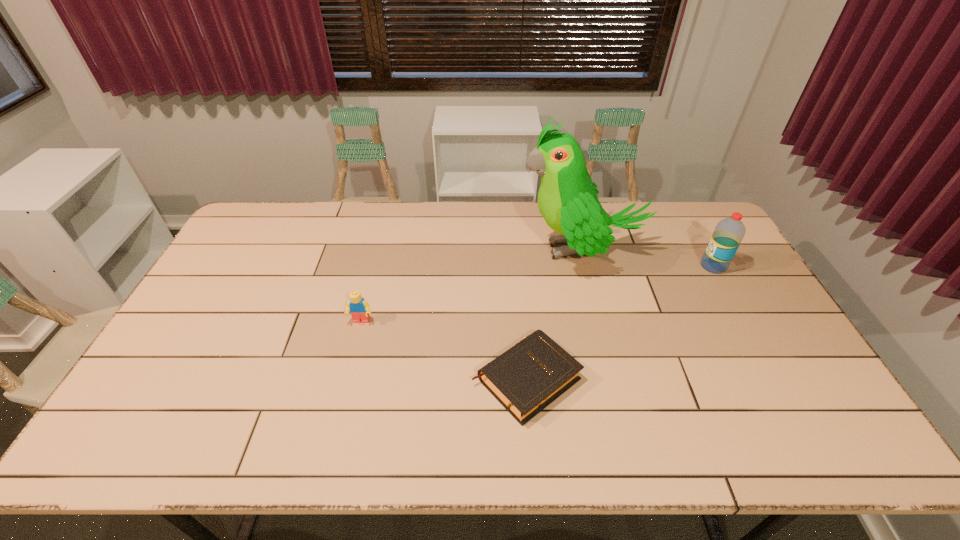
You are a GUI agent. You are given a task and a screenshot of the screen. Output one action in this format:
    pyautogui.click(x=<x>, y=<y>)
    Task: Click on the vacant position located 0.220m on the front label of the rightmost object
    The image size is (960, 540).
    Given the screenshot: What is the action you would take?
    pyautogui.click(x=634, y=266)

Identify the location of vacant position located on the front label of the rightmost object. Image resolution: width=960 pixels, height=540 pixels. (631, 266).

At what (x,y) coordinates should I click in order to perform the action: click on vacant position located 0.120m on the front label of the rightmost object. Please return your answer as a coordinate pair (x, y). Looking at the image, I should click on (664, 266).

Identify the location of free region located on the front-facing side of the third tallest object. The height and width of the screenshot is (540, 960). (330, 443).

Where is `free space located on the back of the nearest object`? Image resolution: width=960 pixels, height=540 pixels. free space located on the back of the nearest object is located at coordinates (521, 320).

You are a GUI agent. You are given a task and a screenshot of the screen. Output one action in this format:
    pyautogui.click(x=<x>, y=<y>)
    Task: Click on the object located in the far edge section of the desktop
    This screenshot has width=960, height=540.
    Given the screenshot: What is the action you would take?
    pyautogui.click(x=567, y=199)

Identify the location of object that is positioned at the near edge. This screenshot has width=960, height=540. (525, 379).

You are a GUI agent. You are given a task and a screenshot of the screen. Output one action in this format:
    pyautogui.click(x=<x>, y=<y>)
    Task: Click on the object that is at the right edge
    This screenshot has height=540, width=960.
    Given the screenshot: What is the action you would take?
    pyautogui.click(x=728, y=234)

In the image, there is a desktop. Where is `vacant space at the far edge`? The image size is (960, 540). vacant space at the far edge is located at coordinates (385, 224).

Locate an element on the screen. This screenshot has height=540, width=960. vacant region at the far left corner of the desktop is located at coordinates (254, 238).